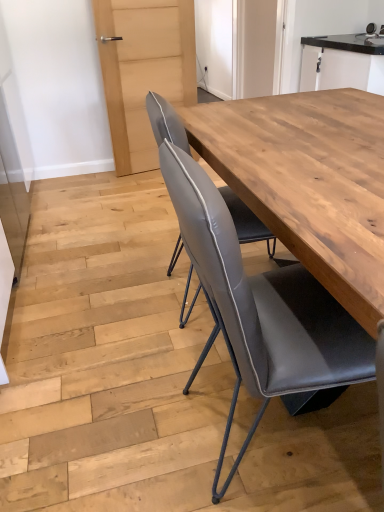
Question: From a real-world perspective, is black glossy cabinet at upper right positioned above or below matte gray leather chair at center?

Choices:
 (A) below
 (B) above

Answer: (B)

Question: Which is correct: black glossy cabinet at upper right is inside matte gray leather chair at center, or outside of it?

Choices:
 (A) inside
 (B) outside

Answer: (B)

Question: Estimate the real-world distances between objects in this image. Which object is farther from the black glossy cabinet at upper right?

Choices:
 (A) matte gray leather chair at center
 (B) natural wood table at center

Answer: (A)

Question: Estimate the real-world distances between objects in this image. Which object is farther from the matte gray leather chair at center?

Choices:
 (A) natural wood table at center
 (B) black glossy cabinet at upper right

Answer: (B)